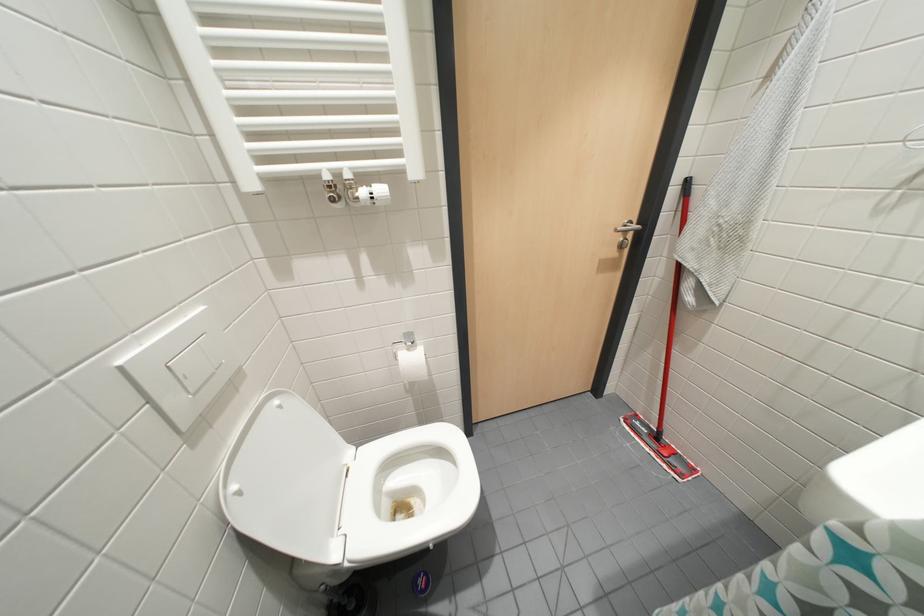
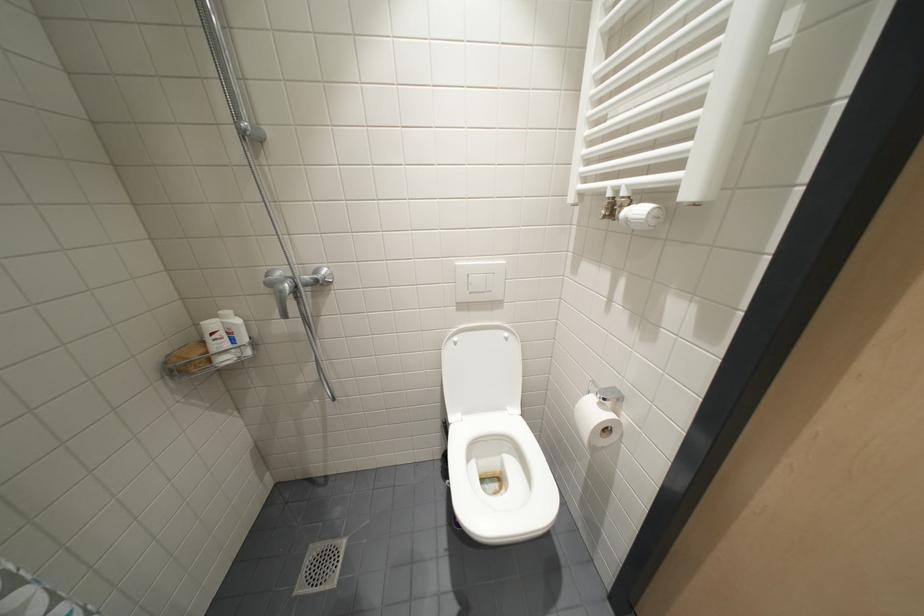
Based on the continuous images, in which direction is the camera rotating?

The camera rotated toward left-down.